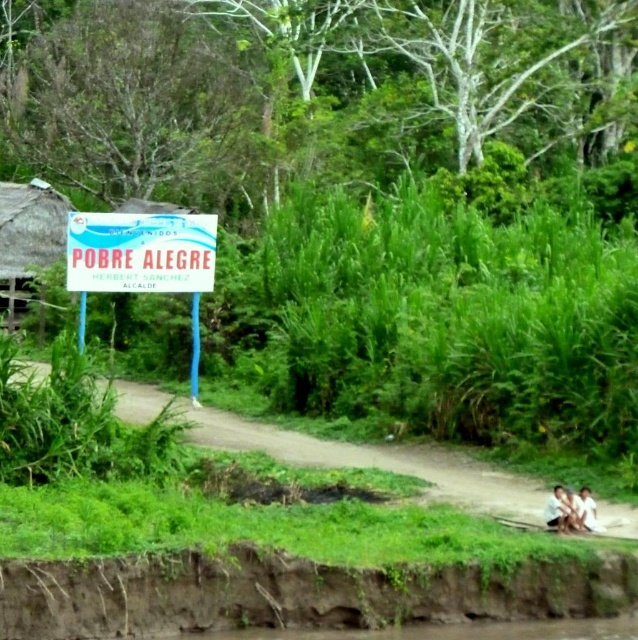
You are a hiker carrying a 30 feet long rope. You want to use the rope to cross from the brown dirt river bank at lower left to the white plastic sign at upper left. Will the rope be long enough?

The distance between the brown dirt river bank at lower left and the white plastic sign at upper left is 27.90 feet. Since the rope is 30 feet long, it will be long enough to cross the distance between them.

You are a hiker trying to read the white plastic sign at upper left and the brown textured fabric at lower right. Which object is taller?

The white plastic sign at upper left is taller than the brown textured fabric at lower right.

You are standing at the entrance of the dirt path and see the brown dirt river bank at lower left and the white plastic sign at upper left. Which object is positioned to the right of the other?

The brown dirt river bank at lower left is to the right of the white plastic sign at upper left.